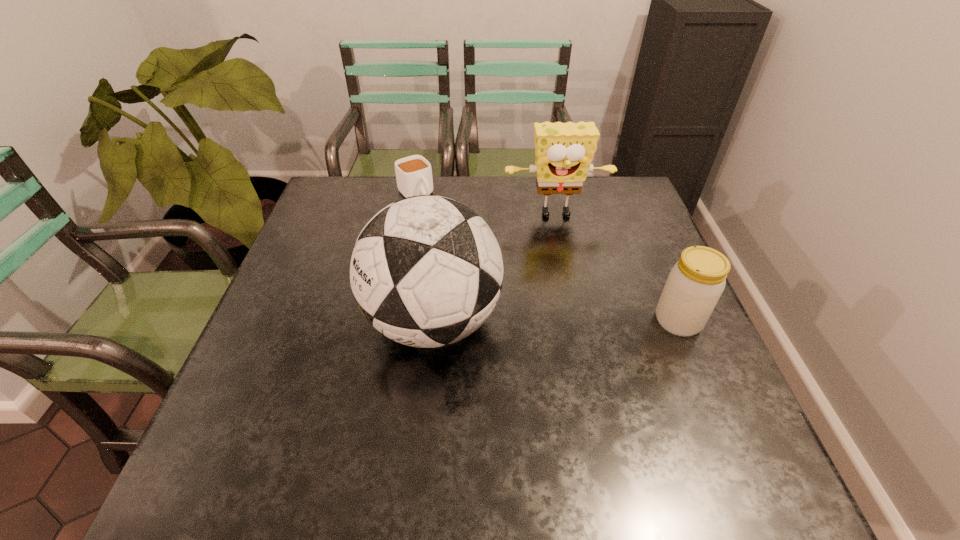
At what (x,y) coordinates should I click in order to perform the action: click on free location located 0.210m on the front-facing side of the third object from left to right. Please return your answer as a coordinate pair (x, y). Looking at the image, I should click on (571, 279).

Where is `vacant point located on the front-facing side of the third object from left to right`? The height and width of the screenshot is (540, 960). vacant point located on the front-facing side of the third object from left to right is located at coordinates (572, 281).

Find the location of `free space located on the front-facing side of the third object from left to right`. free space located on the front-facing side of the third object from left to right is located at coordinates (576, 296).

Locate an element on the screen. vacant space positioned 0.090m on the side with the handle of the shortest object is located at coordinates (437, 220).

Identify the location of vacant space located 0.270m on the side with the handle of the shortest object. The image size is (960, 540). (468, 254).

Find the location of a particular element. Image resolution: width=960 pixels, height=540 pixels. free space located on the side with the handle of the shortest object is located at coordinates (452, 237).

This screenshot has width=960, height=540. I want to click on sponge situated at the far edge, so click(564, 151).

Locate an element on the screen. Image resolution: width=960 pixels, height=540 pixels. cup situated at the far edge is located at coordinates [x=413, y=174].

This screenshot has height=540, width=960. I want to click on jar that is at the right edge, so tap(695, 283).

Find the location of a particular element. This screenshot has height=540, width=960. sponge located at the right edge is located at coordinates (564, 151).